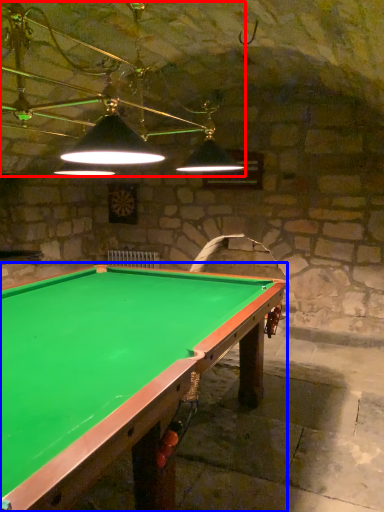
Question: Which object is further to the camera taking this photo, lamp (highlighted by a red box) or billiard table (highlighted by a blue box)?

Choices:
 (A) lamp
 (B) billiard table

Answer: (A)